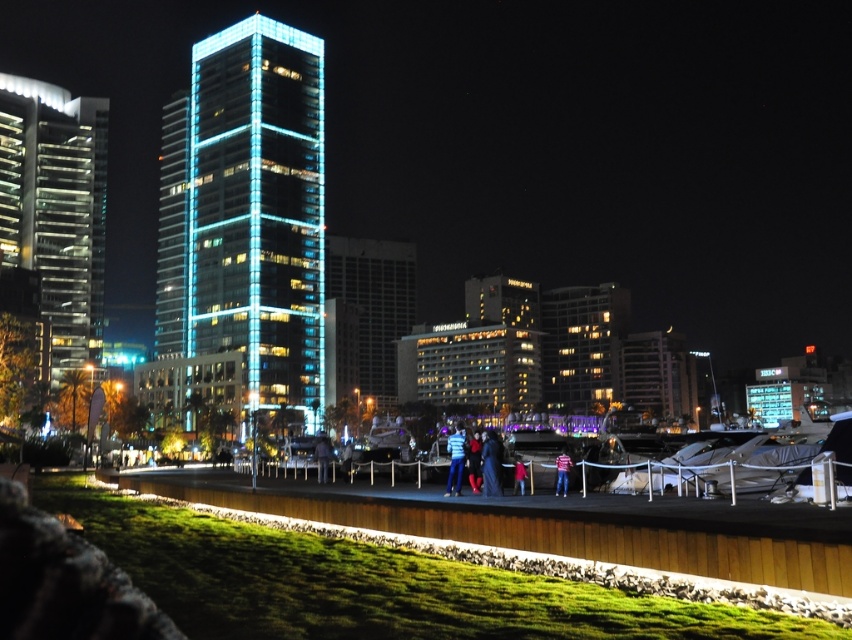
You are standing at the grassy area near the wooden fence and want to walk to the marina. There are two points marked on your map as point 1 at coordinates point (318, 467) and point 2 at coordinates point (516, 483). Which point should you head towards first if you want to reach the marina more quickly?

Point (516, 483) is closer to the marina than point (318, 467), so you should head towards point (516, 483) first to reach the marina more quickly.